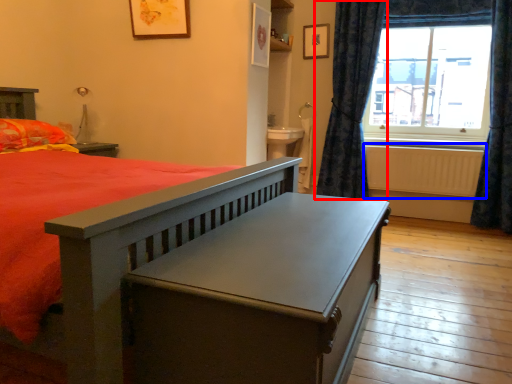
Question: Which of the following is the closest to the observer, curtain (highlighted by a red box) or radiator (highlighted by a blue box)?

Choices:
 (A) curtain
 (B) radiator

Answer: (A)